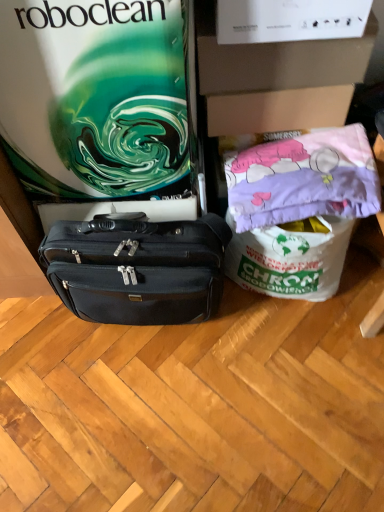
Question: In terms of width, does matte green swirl at upper left look wider or thinner when compared to white cardboard box at upper center?

Choices:
 (A) thin
 (B) wide

Answer: (B)

Question: Considering the positions of matte green swirl at upper left and white cardboard box at upper center in the image, is matte green swirl at upper left taller or shorter than white cardboard box at upper center?

Choices:
 (A) short
 (B) tall

Answer: (B)

Question: Which of these objects is positioned closest to the black leather briefcase at center?

Choices:
 (A) white cardboard box at upper center
 (B) matte green swirl at upper left
 (C) pink fabric pillow at upper right

Answer: (B)

Question: Estimate the real-world distances between objects in this image. Which object is closer to the white cardboard box at upper center?

Choices:
 (A) black leather briefcase at center
 (B) pink fabric pillow at upper right
 (C) matte green swirl at upper left

Answer: (B)